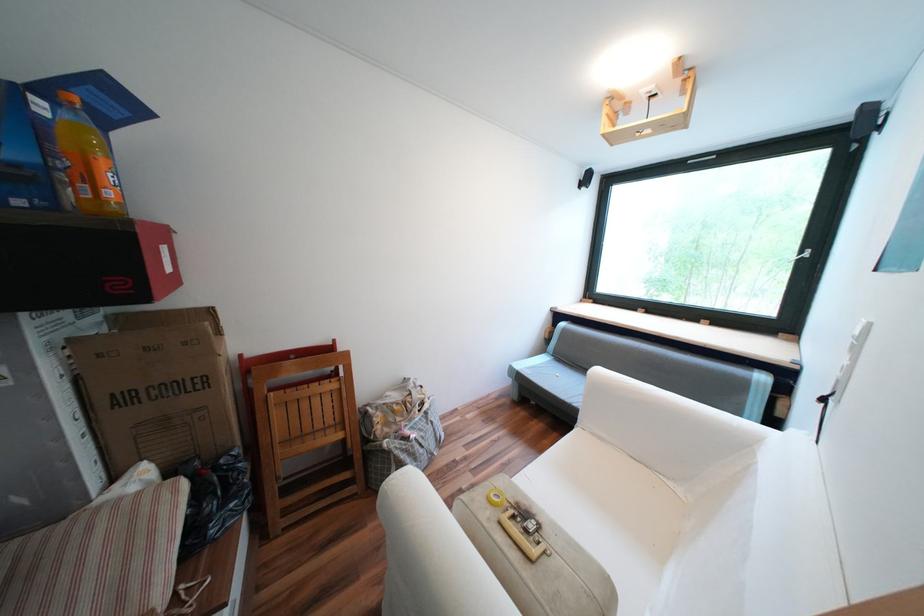
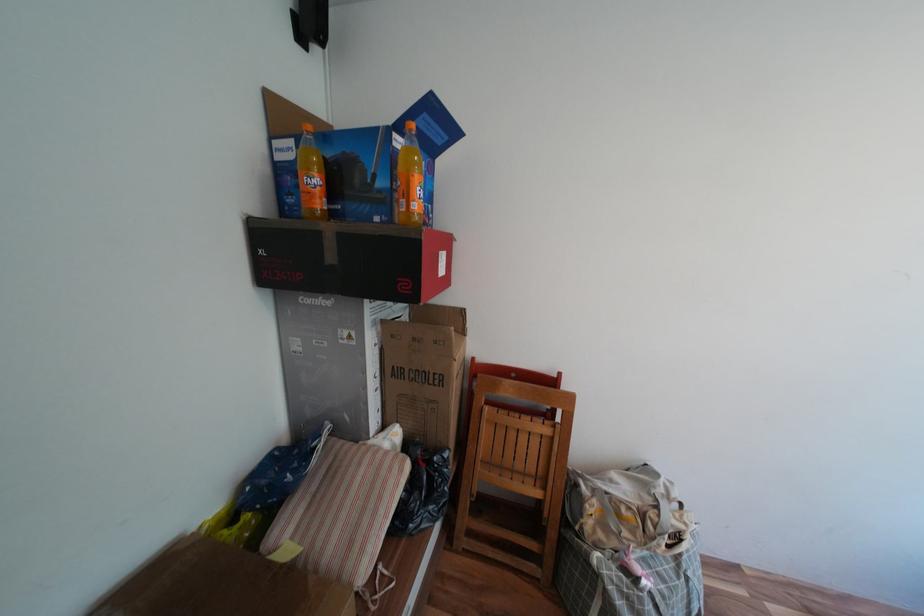
Question: Based on the continuous images, in which direction is the camera rotating? Reply with the corresponding letter.

Choices:
 (A) Left
 (B) Right
 (C) Up
 (D) Down

Answer: (A)